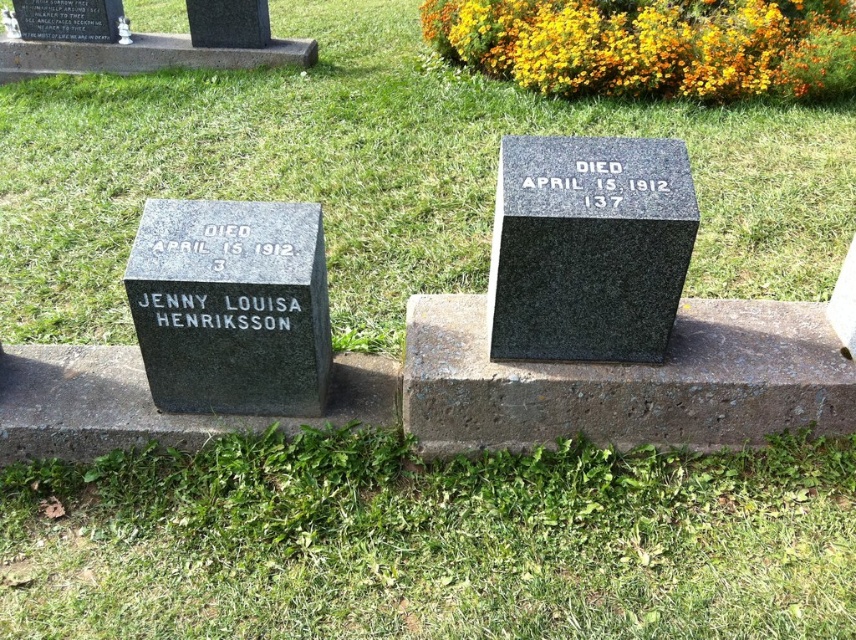
Who is positioned more to the left, green grass at lower center or granite gravestone at left?

From the viewer's perspective, granite gravestone at left appears more on the left side.

Identify the location of green grass at lower center. (431, 541).

Find the location of a particular element. green grass at lower center is located at coordinates (431, 541).

Measure the distance between point (424,630) and camera.

The distance of point (424,630) from camera is 6.49 feet.

Between green grass at lower center and green grass at center, which one appears on the right side from the viewer's perspective?

Positioned to the right is green grass at center.

Where is `green grass at lower center`? This screenshot has width=856, height=640. green grass at lower center is located at coordinates (431, 541).

Can you confirm if green grass at center is shorter than granite gravestone at left?

Correct, green grass at center is not as tall as granite gravestone at left.

Consider the image. Does green grass at center lie in front of granite gravestone at left?

No, green grass at center is behind granite gravestone at left.

Find the location of `green grass at center`. green grass at center is located at coordinates (377, 173).